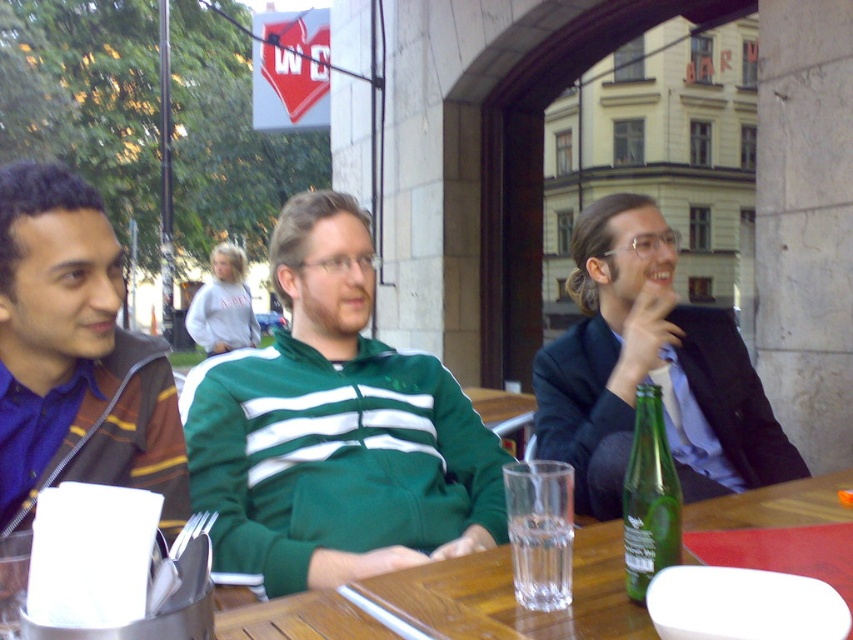
Between green glass bottle at center and transparent glass at table center, which one has less height?

transparent glass at table center is shorter.

Can you confirm if green glass bottle at center is positioned above transparent glass at table center?

Correct, green glass bottle at center is located above transparent glass at table center.

Does point (645, 496) come behind point (515, 564)?

No, it is not.

Where is `green glass bottle at center`? This screenshot has height=640, width=853. green glass bottle at center is located at coordinates (648, 497).

Is wooden table at center smaller than green glass bottle at center?

Incorrect, wooden table at center is not smaller in size than green glass bottle at center.

This screenshot has height=640, width=853. What do you see at coordinates (512, 595) in the screenshot? I see `wooden table at center` at bounding box center [512, 595].

The width and height of the screenshot is (853, 640). I want to click on wooden table at center, so click(512, 595).

Is green fabric jacket at center positioned in front of green glass bottle at center?

No.

Is green fabric jacket at center shorter than green glass bottle at center?

No, green fabric jacket at center is not shorter than green glass bottle at center.

Does point (592, 228) come closer to viewer compared to point (663, 547)?

That is False.

This screenshot has height=640, width=853. What are the coordinates of `green fabric jacket at center` in the screenshot? It's located at pos(648,371).